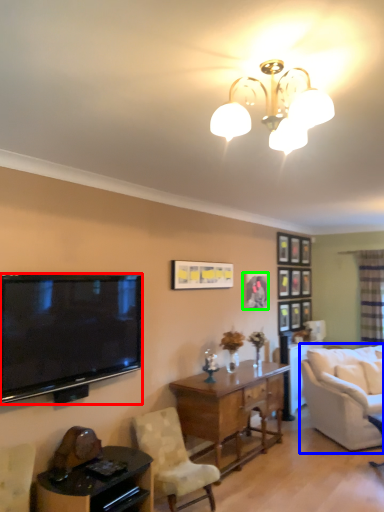
Question: Which object is positioned closest to television (highlighted by a red box)? Select from studio couch (highlighted by a blue box) and picture frame (highlighted by a green box).

Choices:
 (A) studio couch
 (B) picture frame

Answer: (B)